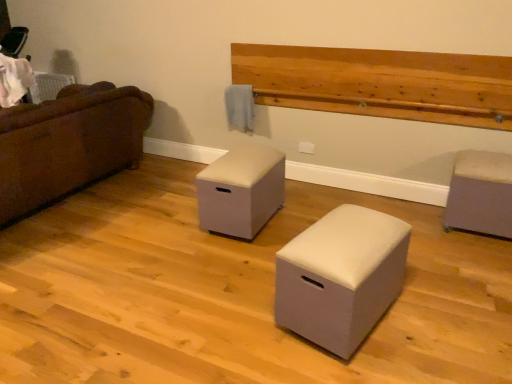
Question: Does white fabric ottoman at center, which is the 2th furniture in right-to-left order, have a lesser height compared to natural wood plank at upper center?

Choices:
 (A) yes
 (B) no

Answer: (B)

Question: Is white fabric ottoman at center, which is the 2th furniture in right-to-left order, oriented towards natural wood plank at upper center?

Choices:
 (A) yes
 (B) no

Answer: (B)

Question: Does white fabric ottoman at center, acting as the 2th furniture starting from the left, come in front of natural wood plank at upper center?

Choices:
 (A) yes
 (B) no

Answer: (A)

Question: Is white fabric ottoman at center, which is the 2th furniture in right-to-left order, bigger than natural wood plank at upper center?

Choices:
 (A) no
 (B) yes

Answer: (A)

Question: Is natural wood plank at upper center inside white fabric ottoman at center, acting as the 2th furniture starting from the left?

Choices:
 (A) no
 (B) yes

Answer: (A)

Question: Considering the positions of beige fabric ottoman at center, which is the 3th furniture from right to left, and matte gray ottoman at right, which appears as the 3th furniture when viewed from the left, in the image, is beige fabric ottoman at center, which is the 3th furniture from right to left, wider or thinner than matte gray ottoman at right, which appears as the 3th furniture when viewed from the left,?

Choices:
 (A) thin
 (B) wide

Answer: (B)

Question: Visually, is beige fabric ottoman at center, which is the 3th furniture from right to left, positioned to the left or to the right of matte gray ottoman at right, the first furniture when ordered from right to left?

Choices:
 (A) right
 (B) left

Answer: (B)

Question: From the image's perspective, is beige fabric ottoman at center, which is the 3th furniture from right to left, positioned above or below matte gray ottoman at right, which appears as the 3th furniture when viewed from the left?

Choices:
 (A) above
 (B) below

Answer: (A)

Question: Is point (222, 216) closer or farther from the camera than point (486, 170)?

Choices:
 (A) closer
 (B) farther

Answer: (B)

Question: Considering the relative positions of matte gray ottoman at right, which appears as the 3th furniture when viewed from the left, and natural wood plank at upper center in the image provided, is matte gray ottoman at right, which appears as the 3th furniture when viewed from the left, to the left or to the right of natural wood plank at upper center?

Choices:
 (A) right
 (B) left

Answer: (A)

Question: Considering their positions, is matte gray ottoman at right, which appears as the 3th furniture when viewed from the left, located in front of or behind natural wood plank at upper center?

Choices:
 (A) behind
 (B) front

Answer: (B)

Question: From a real-world perspective, is matte gray ottoman at right, which appears as the 3th furniture when viewed from the left, physically located above or below natural wood plank at upper center?

Choices:
 (A) below
 (B) above

Answer: (A)

Question: From the image's perspective, is matte gray ottoman at right, the first furniture when ordered from right to left, positioned above or below natural wood plank at upper center?

Choices:
 (A) above
 (B) below

Answer: (B)

Question: Visually, is white fabric ottoman at center, which is the 2th furniture in right-to-left order, positioned to the left or to the right of beige fabric ottoman at center, which is the 3th furniture from right to left?

Choices:
 (A) left
 (B) right

Answer: (B)

Question: From the image's perspective, is white fabric ottoman at center, which is the 2th furniture in right-to-left order, located above or below beige fabric ottoman at center, which is the 3th furniture from right to left?

Choices:
 (A) above
 (B) below

Answer: (B)